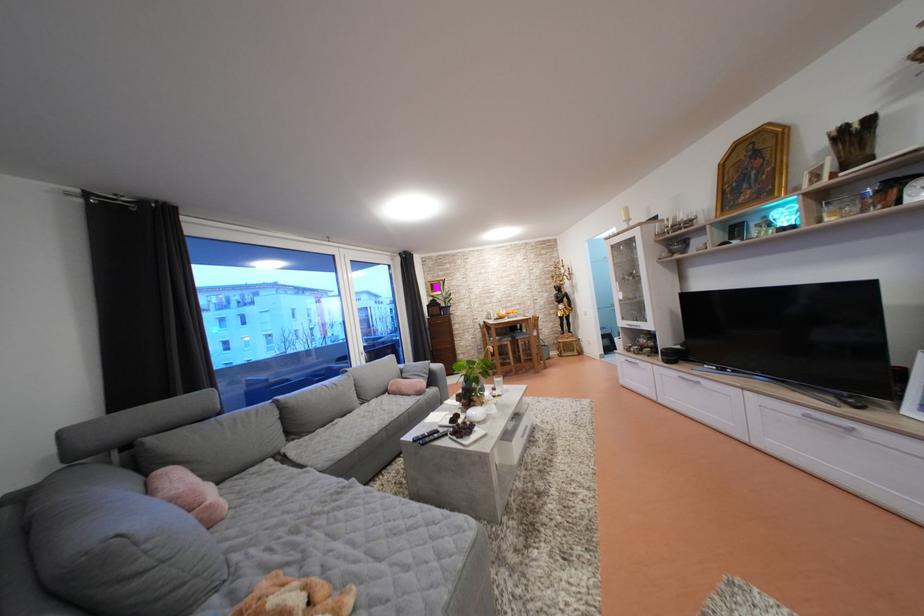
Where would you lift the pink decorative pillow? Please return your answer as a coordinate pair (x, y).

(188, 493)